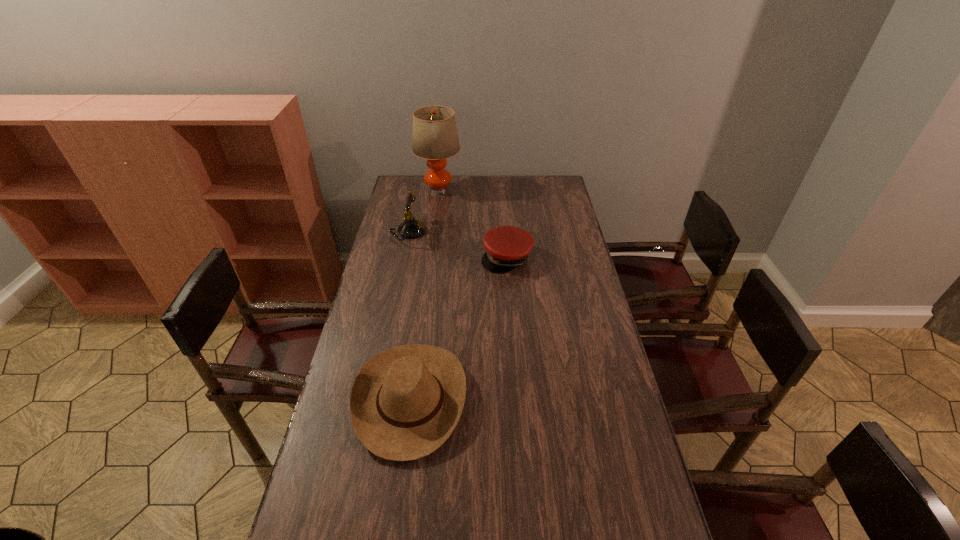
Locate an element on the screen. This screenshot has width=960, height=540. free space between the telephone and the nearest object is located at coordinates (409, 316).

Where is `free space between the cap and the nearest object`? The height and width of the screenshot is (540, 960). free space between the cap and the nearest object is located at coordinates (459, 329).

Identify the location of vacant space that's between the lamp and the cowboy hat. Image resolution: width=960 pixels, height=540 pixels. (424, 294).

Locate an element on the screen. The height and width of the screenshot is (540, 960). free spot between the telephone and the cap is located at coordinates (457, 245).

What are the coordinates of `object that is the closest to the nearest object` in the screenshot? It's located at (507, 247).

At what (x,y) coordinates should I click in order to perform the action: click on the closest object to the telephone. Please return your answer as a coordinate pair (x, y). The width and height of the screenshot is (960, 540). Looking at the image, I should click on (435, 137).